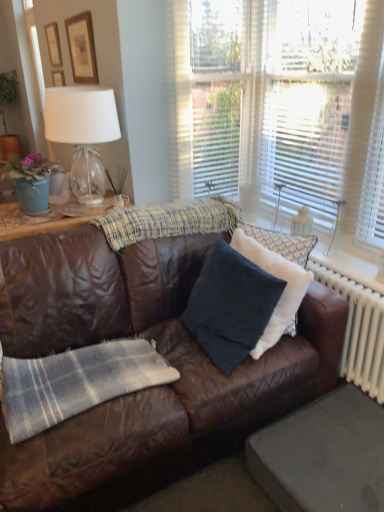
Identify the location of empty space that is ontop of gray fabric footrest at lower right (from a real-world perspective). Image resolution: width=384 pixels, height=512 pixels. (336, 448).